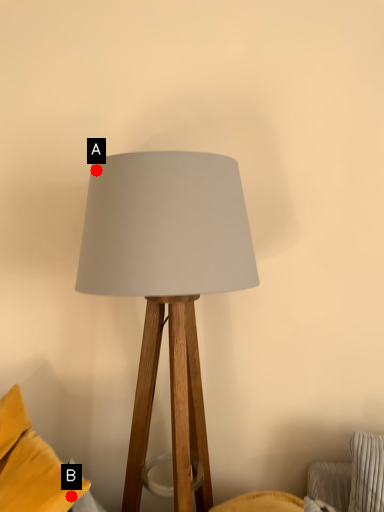
Question: Two points are circled on the image, labeled by A and B beside each circle. Which point is farther from the camera taking this photo?

Choices:
 (A) A is further
 (B) B is further

Answer: (B)